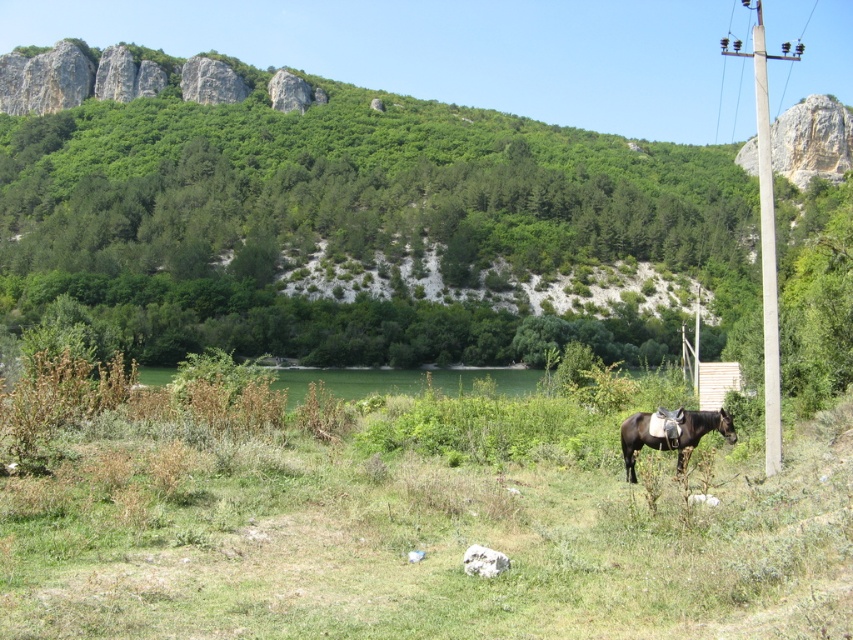
Does concrete pole at right appear on the left side of brown glossy horse at center?

In fact, concrete pole at right is to the right of brown glossy horse at center.

Does concrete pole at right have a larger size compared to brown glossy horse at center?

Yes.

Where is `concrete pole at right`? The image size is (853, 640). concrete pole at right is located at coordinates (767, 252).

Can you confirm if green grassy at center is taller than concrete pole at right?

In fact, green grassy at center may be shorter than concrete pole at right.

Is point (107, 467) less distant than point (753, 84)?

Yes, point (107, 467) is in front of point (753, 84).

At what (x,y) coordinates should I click in order to perform the action: click on green grassy at center. Please return your answer as a coordinate pair (x, y). The height and width of the screenshot is (640, 853). Looking at the image, I should click on (426, 536).

The height and width of the screenshot is (640, 853). In order to click on green grassy at center in this screenshot , I will do `click(426, 536)`.

Can you confirm if green grassy at center is smaller than brown glossy horse at center?

Actually, green grassy at center might be larger than brown glossy horse at center.

I want to click on green grassy at center, so click(426, 536).